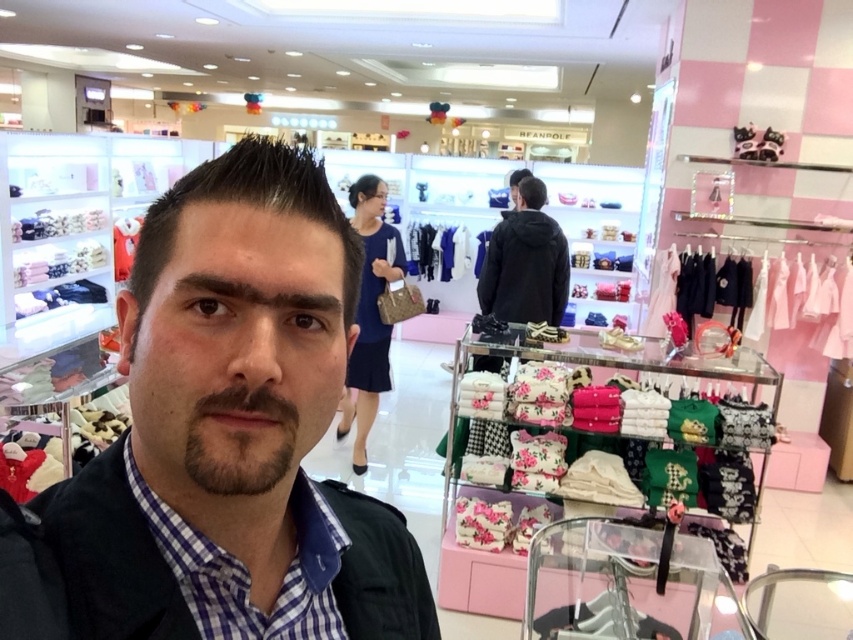
Question: Which point is closer to the camera?

Choices:
 (A) blue checkered shirt at center
 (B) black fleece jacket at center
 (C) matte black jacket at center

Answer: (C)

Question: Which point is farther to the camera?

Choices:
 (A) (312, 634)
 (B) (175, 518)
 (C) (544, 317)

Answer: (C)

Question: Can you confirm if matte black jacket at center is bigger than blue checkered shirt at center?

Choices:
 (A) yes
 (B) no

Answer: (A)

Question: In this image, where is blue checkered shirt at center located relative to black fleece jacket at center?

Choices:
 (A) right
 (B) left

Answer: (B)

Question: Which point appears farthest from the camera in this image?

Choices:
 (A) (322, 548)
 (B) (194, 556)
 (C) (480, 282)

Answer: (C)

Question: Can you confirm if matte black jacket at center is positioned below blue checkered shirt at center?

Choices:
 (A) yes
 (B) no

Answer: (B)